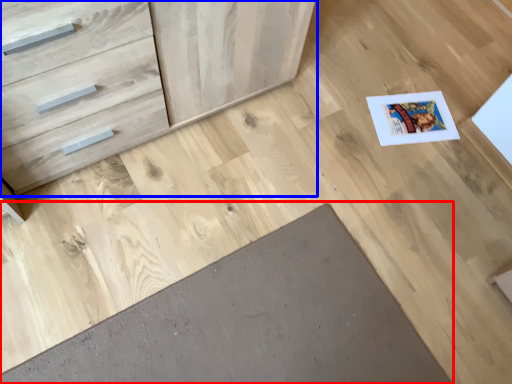
Question: Which of the following is the closest to the observer, doormat (highlighted by a red box) or chest of drawers (highlighted by a blue box)?

Choices:
 (A) doormat
 (B) chest of drawers

Answer: (B)